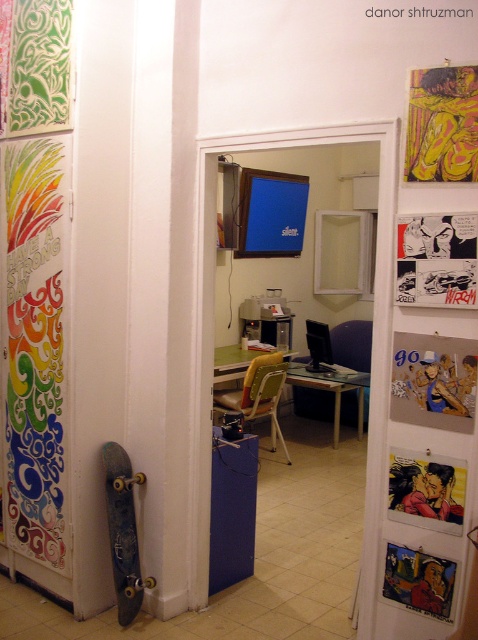
Question: Considering the real-world distances, which object is farthest from the comic book page at upper right?

Choices:
 (A) matte acrylic painting of two figures at center
 (B) blue matte skateboard at lower left
 (C) oil painting portrait at center

Answer: (B)

Question: Which is nearer to the rainbow swirls paper at left?

Choices:
 (A) yellow textured fabric at upper right
 (B) blue matte skateboard at lower left
 (C) comic book page at upper right

Answer: (B)

Question: Is comic book page at upper right further to camera compared to matte acrylic painting of two figures at center?

Choices:
 (A) no
 (B) yes

Answer: (A)

Question: Which of the following is the closest to the observer?

Choices:
 (A) comic book page at upper right
 (B) oil painting portrait at center

Answer: (A)

Question: Can you confirm if rainbow swirls paper at left is wider than matte paper poster at center?

Choices:
 (A) yes
 (B) no

Answer: (A)

Question: Does rainbow swirls paper at left have a larger size compared to blue matte skateboard at lower left?

Choices:
 (A) no
 (B) yes

Answer: (B)